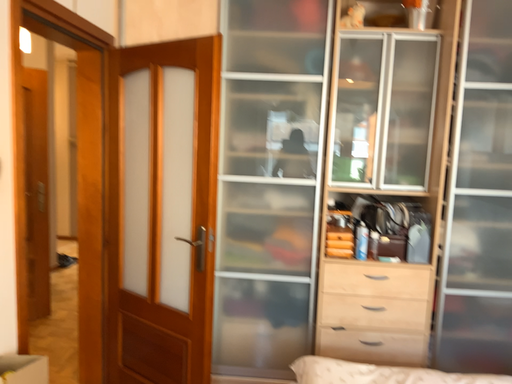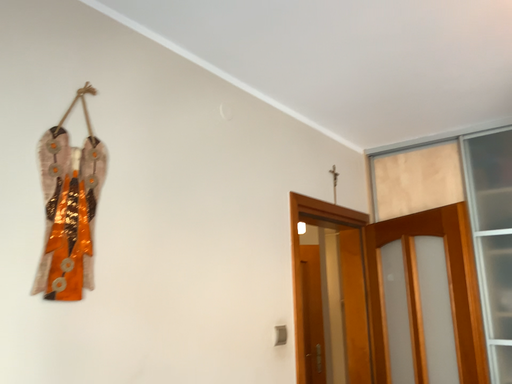
Question: How did the camera likely rotate when shooting the video?

Choices:
 (A) rotated right
 (B) rotated left

Answer: (B)